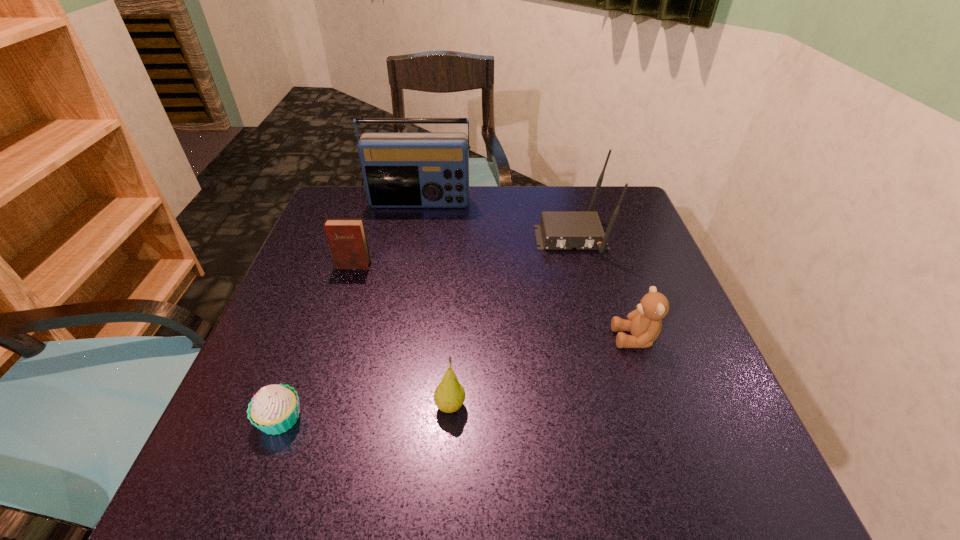
Find the location of a particular element. free spot at the near left corner of the desktop is located at coordinates (290, 469).

You are a GUI agent. You are given a task and a screenshot of the screen. Output one action in this format:
    pyautogui.click(x=<x>, y=<y>)
    Task: Click on the vacant space at the far right corner of the desktop
    The width and height of the screenshot is (960, 540).
    Given the screenshot: What is the action you would take?
    pyautogui.click(x=615, y=187)

The image size is (960, 540). In the image, there is a desktop. Identify the location of vacant space at the near right corner. (685, 457).

At what (x,y) coordinates should I click in order to perform the action: click on vacant space in between the pear and the cupcake. Please return your answer as a coordinate pair (x, y). The width and height of the screenshot is (960, 540). Looking at the image, I should click on (366, 413).

You are a GUI agent. You are given a task and a screenshot of the screen. Output one action in this format:
    pyautogui.click(x=<x>, y=<y>)
    Task: Click on the free area in between the fourth nearest object and the cupcake
    Image resolution: width=960 pixels, height=540 pixels.
    Given the screenshot: What is the action you would take?
    [x=317, y=342]

You are a GUI agent. You are given a task and a screenshot of the screen. Output one action in this format:
    pyautogui.click(x=<x>, y=<y>)
    Task: Click on the vacant space in between the shortest object and the fourth farthest object
    This screenshot has height=540, width=960.
    Given the screenshot: What is the action you would take?
    pyautogui.click(x=458, y=378)

Identify the location of vacant area that lies between the shortest object and the pear. Image resolution: width=960 pixels, height=540 pixels. (366, 413).

Identify the location of blank region between the cupcake and the fourth nearest object. (317, 342).

Find the location of a particular element. unoccupied area between the cupcake and the farthest object is located at coordinates (350, 311).

The image size is (960, 540). Find the location of `unoccupied area between the third farthest object and the cupcake`. unoccupied area between the third farthest object and the cupcake is located at coordinates (317, 342).